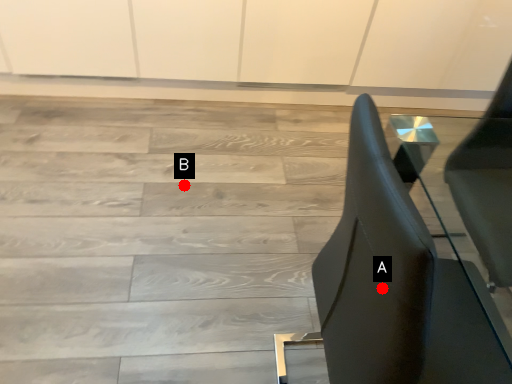
Question: Two points are circled on the image, labeled by A and B beside each circle. Which of the following is the closest to the observer?

Choices:
 (A) A is closer
 (B) B is closer

Answer: (A)